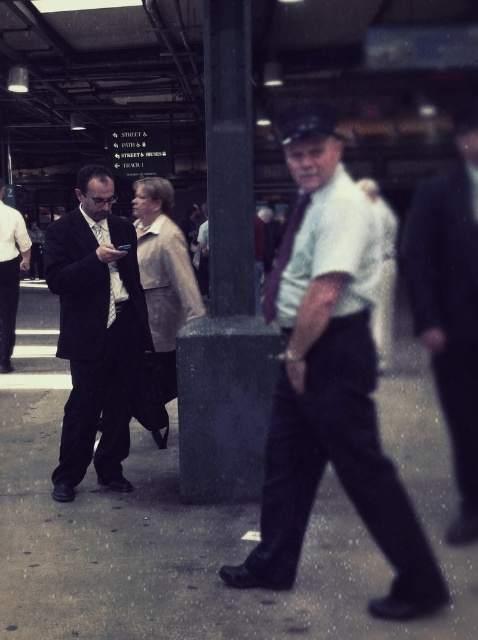
Is point (344, 397) positioned behind point (93, 323)?

No, it is in front of (93, 323).

Is white shirt at center to the left of dark suit at left from the viewer's perspective?

In fact, white shirt at center is to the right of dark suit at left.

This screenshot has height=640, width=478. In order to click on white shirt at center in this screenshot , I will do `click(329, 380)`.

Is matte black suit at left below matte black tie at left?

No, matte black suit at left is not below matte black tie at left.

Between matte black suit at left and matte black tie at left, which one is positioned lower?

matte black tie at left is lower down.

Who is more distant from viewer, (x=21, y=236) or (x=109, y=260)?

Positioned behind is point (x=21, y=236).

You are a GUI agent. You are given a task and a screenshot of the screen. Output one action in this format:
    pyautogui.click(x=<x>, y=<y>)
    Task: Click on the matte black suit at left
    The height and width of the screenshot is (640, 478).
    Given the screenshot: What is the action you would take?
    pyautogui.click(x=10, y=275)

Who is taller, white shirt at center or matte black suit at left?

matte black suit at left is taller.

From the picture: Who is lower down, white shirt at center or matte black suit at left?

Positioned lower is white shirt at center.

You are a GUI agent. You are given a task and a screenshot of the screen. Output one action in this format:
    pyautogui.click(x=<x>, y=<y>)
    Task: Click on the white shirt at center
    
    Given the screenshot: What is the action you would take?
    pyautogui.click(x=329, y=380)

Where is `white shirt at center`? The image size is (478, 640). white shirt at center is located at coordinates (329, 380).